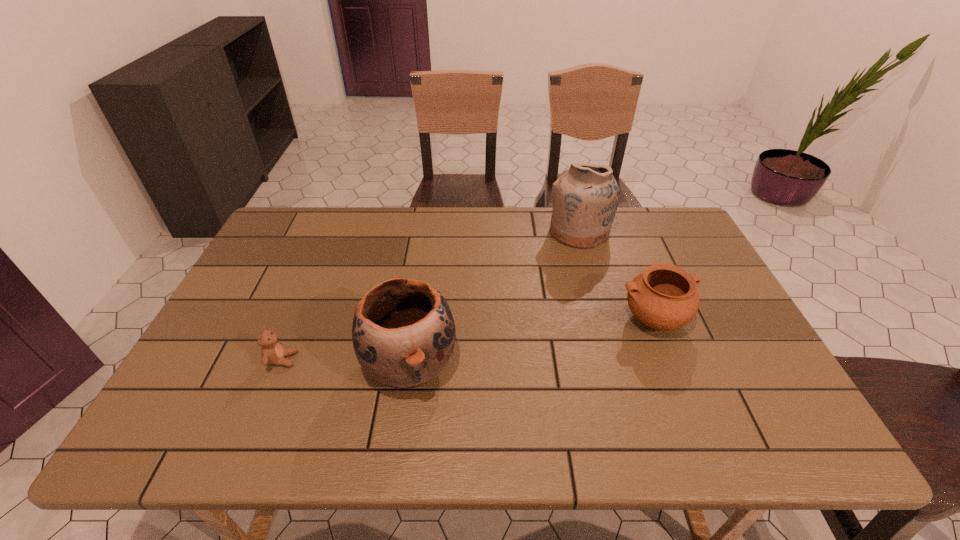
Find the location of a particular element. This screenshot has width=960, height=540. free space located 0.320m on the front-facing side of the leftmost object is located at coordinates (428, 360).

In order to click on object that is at the far edge in this screenshot , I will do `click(585, 197)`.

Where is `object that is at the near edge`? Image resolution: width=960 pixels, height=540 pixels. object that is at the near edge is located at coordinates (403, 333).

This screenshot has height=540, width=960. I want to click on object at the right edge, so click(664, 297).

Identify the location of vacant position at the far edge of the desktop. This screenshot has width=960, height=540. (559, 242).

In the image, there is a desktop. At what (x,y) coordinates should I click in order to perform the action: click on vacant space at the near edge. Please return your answer as a coordinate pair (x, y). Looking at the image, I should click on (708, 426).

The image size is (960, 540). I want to click on free point at the left edge, so click(x=209, y=343).

Locate an element on the screen. This screenshot has height=540, width=960. vacant space at the far right corner is located at coordinates (643, 218).

This screenshot has width=960, height=540. Identify the location of vacant space at the near right corner of the desktop. (754, 446).

Where is `vacant area that lies between the shortest pottery and the teddy bear`? This screenshot has width=960, height=540. vacant area that lies between the shortest pottery and the teddy bear is located at coordinates (468, 340).